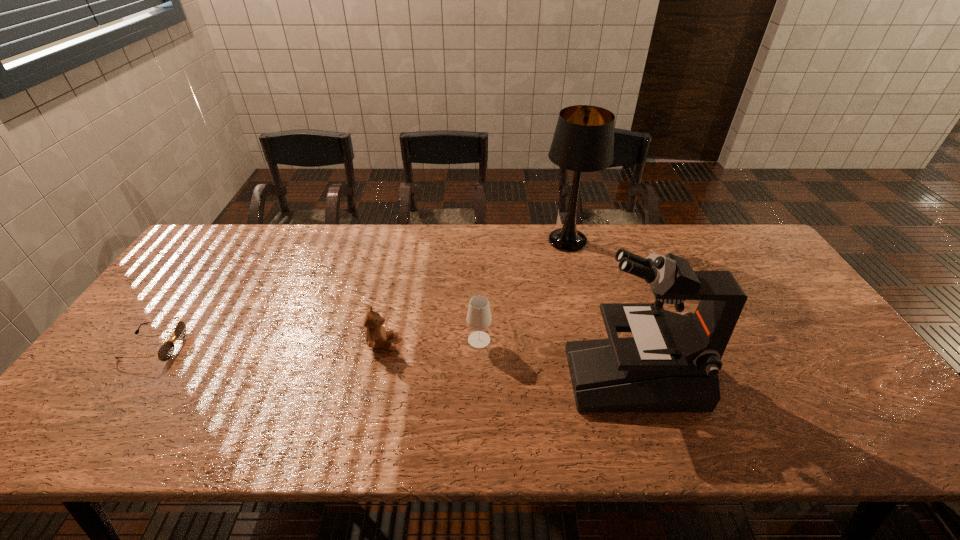
Where is `vacant area situated 0.140m through the eyepieces of the microscope`? The height and width of the screenshot is (540, 960). vacant area situated 0.140m through the eyepieces of the microscope is located at coordinates click(513, 377).

Where is `vacant space situated on the front of the third object from left to right`? vacant space situated on the front of the third object from left to right is located at coordinates (479, 443).

Locate an element on the screen. This screenshot has width=960, height=540. vacant point located on the front-facing side of the fourth object from right to left is located at coordinates (478, 343).

At what (x,y) coordinates should I click in order to perform the action: click on free region located 0.190m on the lenses of the shortest object. Please return your answer as a coordinate pair (x, y). Looking at the image, I should click on (252, 347).

What are the coordinates of `object at the far edge` in the screenshot? It's located at (583, 141).

Identify the location of object located at the near edge. (671, 363).

What are the coordinates of `object located in the left edge section of the desktop` in the screenshot? It's located at (165, 352).

At what (x,y) coordinates should I click in order to perform the action: click on vacant space at the far edge of the desktop. Please return your answer as a coordinate pair (x, y). Image resolution: width=960 pixels, height=540 pixels. Looking at the image, I should click on (399, 264).

Find the location of a particular element. The height and width of the screenshot is (540, 960). vacant space at the near edge is located at coordinates (715, 430).

Identify the location of vacant space at the left edge of the desktop. This screenshot has height=540, width=960. (161, 314).